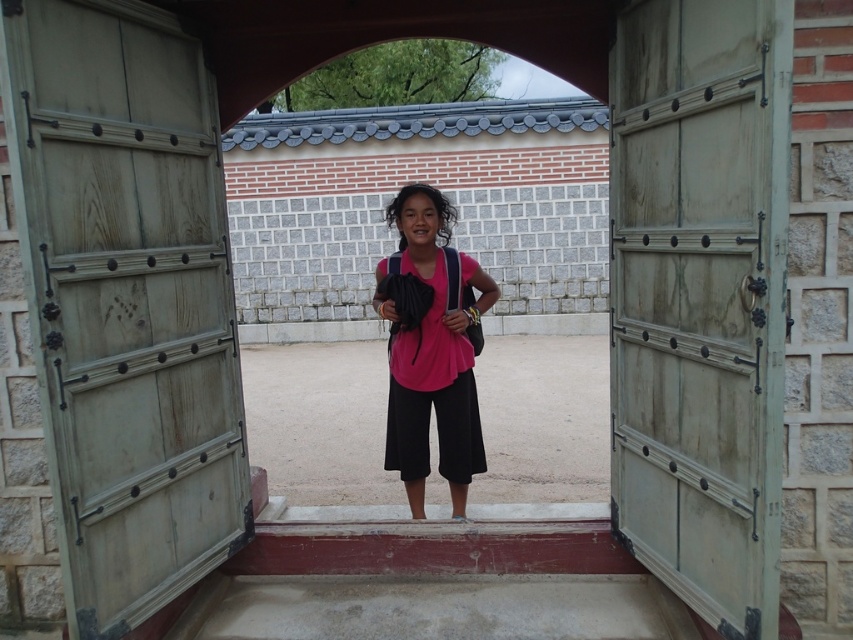
Question: Which point appears farthest from the camera in this image?

Choices:
 (A) (688, 128)
 (B) (132, 29)
 (C) (387, 416)

Answer: (C)

Question: Which of the following is the farthest from the observer?

Choices:
 (A) greenish-gray wood door at center
 (B) pink fabric shirt at center

Answer: (B)

Question: Which object is closer to the camera taking this photo?

Choices:
 (A) greenish-gray wood door at center
 (B) green wood door at center

Answer: (A)

Question: Can you confirm if green wood door at center is positioned to the left of pink fabric shirt at center?

Choices:
 (A) yes
 (B) no

Answer: (A)

Question: Is green wood door at center smaller than greenish-gray wood door at center?

Choices:
 (A) no
 (B) yes

Answer: (A)

Question: Is greenish-gray wood door at center in front of pink fabric shirt at center?

Choices:
 (A) yes
 (B) no

Answer: (A)